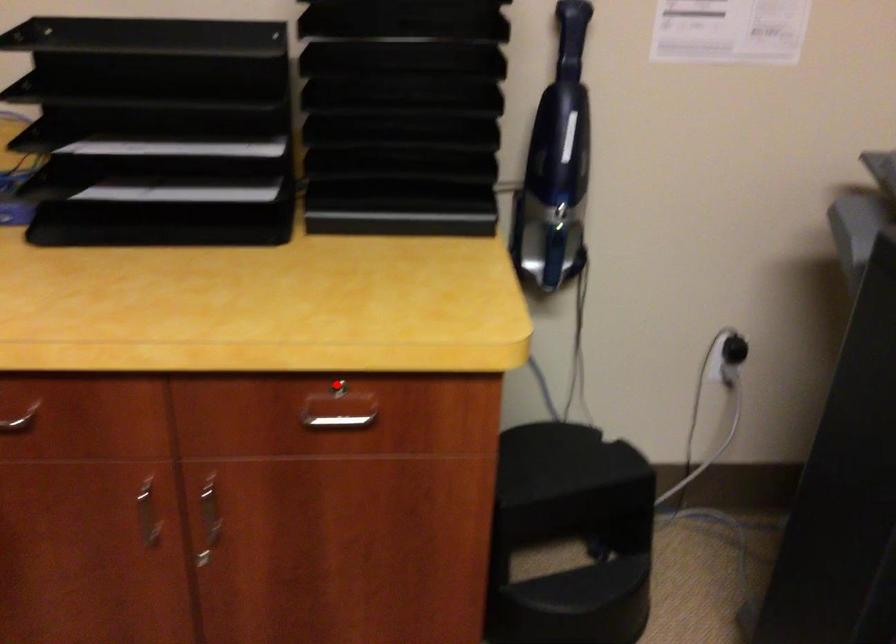
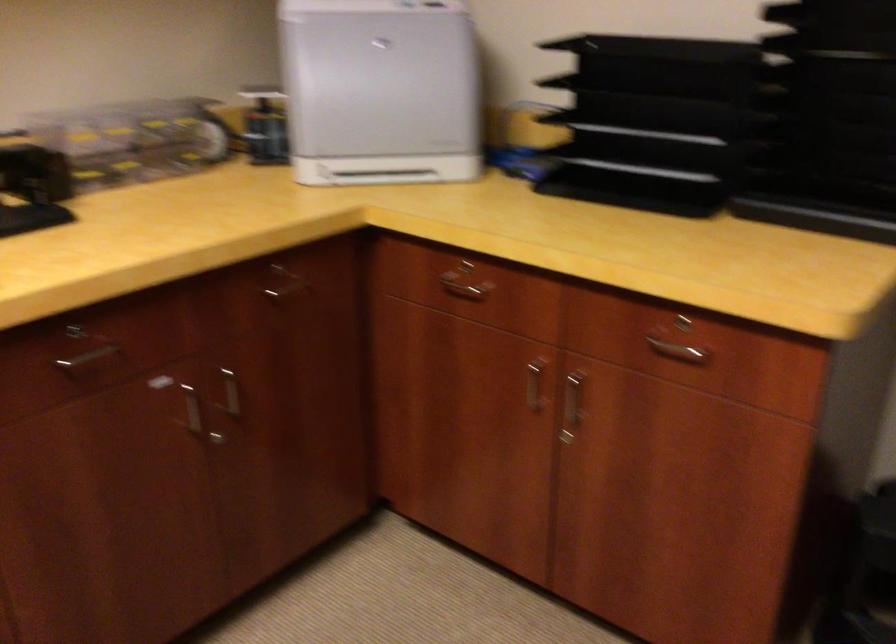
Question: I am providing you with two images of the same scene from different viewpoints. Given a red point in image1, look at the same physical point in image2. Is it:

Choices:
 (A) Closer to the viewpoint
 (B) Farther from the viewpoint

Answer: (B)